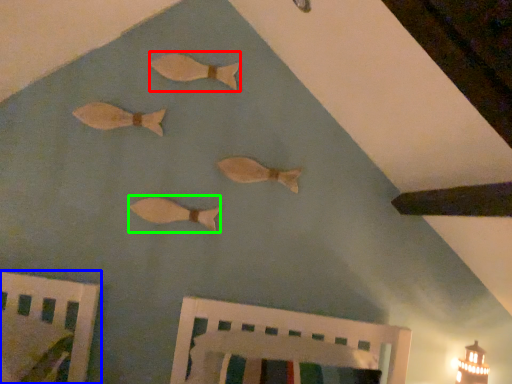
Question: Considering the real-world distances, which object is farthest from fish (highlighted by a red box)? furniture (highlighted by a blue box) or fish (highlighted by a green box)?

Choices:
 (A) furniture
 (B) fish

Answer: (A)